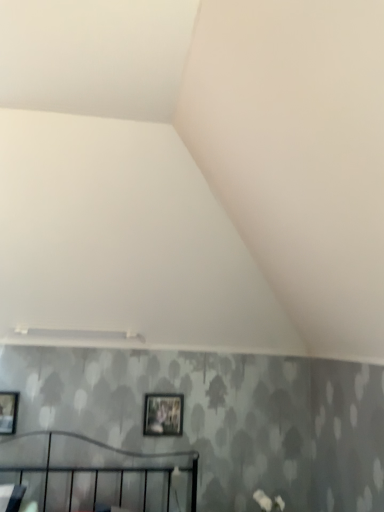
Question: Is matte black picture frame at left, marked as the first picture frame in a left-to-right arrangement, shorter than matte black picture frame at center, which is the second picture frame in left-to-right order?

Choices:
 (A) no
 (B) yes

Answer: (B)

Question: Can you confirm if matte black picture frame at left, which is the 2th picture frame in back-to-front order, is thinner than matte black picture frame at center, marked as the 1th picture frame in a back-to-front arrangement?

Choices:
 (A) no
 (B) yes

Answer: (A)

Question: Is matte black picture frame at center, which is the second picture frame in left-to-right order, at the back of matte black picture frame at left, marked as the first picture frame in a left-to-right arrangement?

Choices:
 (A) no
 (B) yes

Answer: (A)

Question: From a real-world perspective, is matte black picture frame at left, the 1th picture frame viewed from the front, on top of matte black picture frame at center, marked as the 1th picture frame in a back-to-front arrangement?

Choices:
 (A) yes
 (B) no

Answer: (B)

Question: Is matte black picture frame at left, the 2th picture frame viewed from the right, closer to camera compared to matte black picture frame at center, positioned as the 1th picture frame in right-to-left order?

Choices:
 (A) no
 (B) yes

Answer: (B)

Question: Considering their positions, is white matte flower at lower right located in front of or behind matte black picture frame at left, the 1th picture frame viewed from the front?

Choices:
 (A) behind
 (B) front

Answer: (B)

Question: Considering the positions of point (266, 510) and point (4, 394), is point (266, 510) closer or farther from the camera than point (4, 394)?

Choices:
 (A) closer
 (B) farther

Answer: (A)

Question: From a real-world perspective, is white matte flower at lower right above or below matte black picture frame at left, the 1th picture frame viewed from the front?

Choices:
 (A) above
 (B) below

Answer: (B)

Question: Looking at the image, does white matte flower at lower right seem bigger or smaller compared to matte black picture frame at left, the 2th picture frame viewed from the right?

Choices:
 (A) big
 (B) small

Answer: (A)

Question: Is matte black picture frame at center, positioned as the 2th picture frame in front-to-back order, to the left or to the right of matte black picture frame at left, the 2th picture frame viewed from the right, in the image?

Choices:
 (A) right
 (B) left

Answer: (A)

Question: In terms of width, does matte black picture frame at center, positioned as the 1th picture frame in right-to-left order, look wider or thinner when compared to matte black picture frame at left, which is the 2th picture frame in back-to-front order?

Choices:
 (A) wide
 (B) thin

Answer: (B)

Question: Looking at the image, does matte black picture frame at center, which is the second picture frame in left-to-right order, seem bigger or smaller compared to matte black picture frame at left, marked as the first picture frame in a left-to-right arrangement?

Choices:
 (A) small
 (B) big

Answer: (A)

Question: Do you think matte black picture frame at center, positioned as the 1th picture frame in right-to-left order, is within matte black picture frame at left, the 1th picture frame viewed from the front, or outside of it?

Choices:
 (A) inside
 (B) outside

Answer: (B)

Question: Is matte black picture frame at left, the 2th picture frame viewed from the right, taller or shorter than matte black picture frame at center, marked as the 1th picture frame in a back-to-front arrangement?

Choices:
 (A) tall
 (B) short

Answer: (B)

Question: Is matte black picture frame at left, the 1th picture frame viewed from the front, wider or thinner than matte black picture frame at center, positioned as the 1th picture frame in right-to-left order?

Choices:
 (A) thin
 (B) wide

Answer: (B)